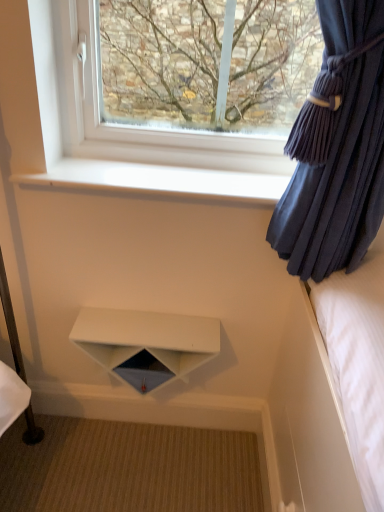
I want to click on white matte shelf at center, so tap(146, 344).

From the image's perspective, is white matte shelf at center on white smooth window sill at upper center?

No, from the image's perspective, white matte shelf at center is not above white smooth window sill at upper center.

From a real-world perspective, which is physically below, white matte shelf at center or white smooth window sill at upper center?

white matte shelf at center is physically lower.

Who is bigger, white matte shelf at center or white smooth window sill at upper center?

With larger size is white matte shelf at center.

Is white matte shelf at center closer to camera compared to white smooth window sill at upper center?

No.

What's the angular difference between white smooth window sill at upper center and transparent glass window at upper center's facing directions?

They differ by 0.107 degrees in their facing directions.

Relative to transparent glass window at upper center, is white smooth window sill at upper center in front or behind?

white smooth window sill at upper center is behind transparent glass window at upper center.

Is white smooth window sill at upper center outside of transparent glass window at upper center?

white smooth window sill at upper center lies outside transparent glass window at upper center's area.

From a real-world perspective, is white smooth window sill at upper center physically below transparent glass window at upper center?

Correct, in the physical world, white smooth window sill at upper center is lower than transparent glass window at upper center.

Can you confirm if transparent glass window at upper center is bigger than white smooth window sill at upper center?

Yes.

Is transparent glass window at upper center outside of white smooth window sill at upper center?

Yes, transparent glass window at upper center is located beyond the bounds of white smooth window sill at upper center.

Consider the image. From a real-world perspective, is transparent glass window at upper center positioned under white smooth window sill at upper center based on gravity?

No, from a real-world perspective, transparent glass window at upper center is not below white smooth window sill at upper center.

In the scene shown: Which object is closer to the camera taking this photo, transparent glass window at upper center or white smooth window sill at upper center?

transparent glass window at upper center is more forward.

How far apart are velvet dark blue curtain at right and transparent glass window at upper center?

The distance of velvet dark blue curtain at right from transparent glass window at upper center is 13.36 inches.

The width and height of the screenshot is (384, 512). I want to click on curtain that appears below the transparent glass window at upper center (from the image's perspective), so click(337, 149).

Can you tell me how much velvet dark blue curtain at right and transparent glass window at upper center differ in facing direction?

1.7 degrees separate the facing orientations of velvet dark blue curtain at right and transparent glass window at upper center.

Can you confirm if velvet dark blue curtain at right is taller than transparent glass window at upper center?

Yes.

How many degrees apart are the facing directions of white matte shelf at center and transparent glass window at upper center?

The angle between the facing direction of white matte shelf at center and the facing direction of transparent glass window at upper center is 0.263 degrees.

Is white matte shelf at center far from transparent glass window at upper center?

No, white matte shelf at center is not far away from transparent glass window at upper center.

Where is `window on the right side of white matte shelf at center`? Image resolution: width=384 pixels, height=512 pixels. window on the right side of white matte shelf at center is located at coordinates (189, 76).

Considering the positions of points (104, 332) and (212, 105), is point (104, 332) farther from camera compared to point (212, 105)?

Yes.

Is velvet dark blue curtain at right turned away from white smooth window sill at upper center?

That's right, velvet dark blue curtain at right is facing away from white smooth window sill at upper center.

Considering the sizes of objects velvet dark blue curtain at right and white smooth window sill at upper center in the image provided, who is smaller, velvet dark blue curtain at right or white smooth window sill at upper center?

white smooth window sill at upper center.

From the picture: Is velvet dark blue curtain at right thinner than white smooth window sill at upper center?

Yes, velvet dark blue curtain at right is thinner than white smooth window sill at upper center.

Looking at this image, does velvet dark blue curtain at right lie behind white matte shelf at center?

That is False.

Identify the location of curtain lying above the white matte shelf at center (from the image's perspective). (337, 149).

How much distance is there between velvet dark blue curtain at right and white matte shelf at center?

velvet dark blue curtain at right and white matte shelf at center are 21.69 inches apart.

Locate an element on the screen. shelf on the left of the white smooth window sill at upper center is located at coordinates (146, 344).

Where is `window lying above the white smooth window sill at upper center (from the image's perspective)`? The width and height of the screenshot is (384, 512). window lying above the white smooth window sill at upper center (from the image's perspective) is located at coordinates (189, 76).

Based on their spatial positions, is white smooth window sill at upper center or transparent glass window at upper center closer to velvet dark blue curtain at right?

Based on the image, white smooth window sill at upper center appears to be nearer to velvet dark blue curtain at right.

Which object lies further to the anchor point white matte shelf at center, velvet dark blue curtain at right or transparent glass window at upper center?

transparent glass window at upper center is further to white matte shelf at center.

Estimate the real-world distances between objects in this image. Which object is closer to transparent glass window at upper center, velvet dark blue curtain at right or white smooth window sill at upper center?

white smooth window sill at upper center is closer to transparent glass window at upper center.

From the image, which object appears to be nearer to white matte shelf at center, white smooth window sill at upper center or velvet dark blue curtain at right?

white smooth window sill at upper center is positioned closer to the anchor white matte shelf at center.

Which object lies nearer to the anchor point white matte shelf at center, transparent glass window at upper center or velvet dark blue curtain at right?

velvet dark blue curtain at right is positioned closer to the anchor white matte shelf at center.

Based on their spatial positions, is white matte shelf at center or transparent glass window at upper center closer to white smooth window sill at upper center?

Based on the image, transparent glass window at upper center appears to be nearer to white smooth window sill at upper center.

Based on their spatial positions, is velvet dark blue curtain at right or transparent glass window at upper center further from white smooth window sill at upper center?

velvet dark blue curtain at right is further to white smooth window sill at upper center.

Which object lies nearer to the anchor point transparent glass window at upper center, white matte shelf at center or white smooth window sill at upper center?

white smooth window sill at upper center is closer to transparent glass window at upper center.

Image resolution: width=384 pixels, height=512 pixels. I want to click on window sill between velvet dark blue curtain at right and white matte shelf at center from top to bottom, so click(159, 180).

This screenshot has width=384, height=512. What are the coordinates of `window sill between transparent glass window at upper center and white matte shelf at center in the vertical direction` in the screenshot? It's located at (159, 180).

Find the location of `curtain between transparent glass window at upper center and white matte shelf at center in the vertical direction`. curtain between transparent glass window at upper center and white matte shelf at center in the vertical direction is located at coordinates 337,149.

The image size is (384, 512). I want to click on window located between velvet dark blue curtain at right and white smooth window sill at upper center in the depth direction, so click(x=189, y=76).